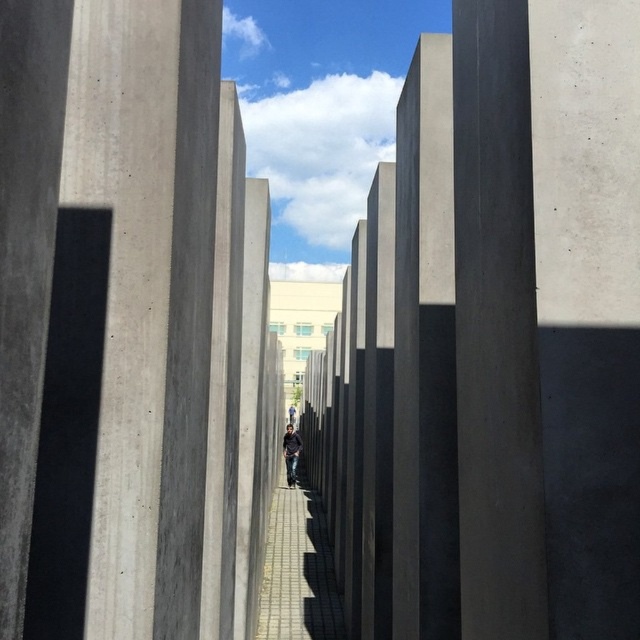
Does smooth concrete pillar at center appear on the left side of gray brick pavement at center?

No, smooth concrete pillar at center is not to the left of gray brick pavement at center.

Is point (477, 586) closer to viewer compared to point (285, 637)?

Yes, it is.

Locate an element on the screen. This screenshot has width=640, height=640. smooth concrete pillar at center is located at coordinates (496, 326).

Is smooth concrete pillar at center positioned at the back of dark blue jeans at center?

That is False.

Which of these two, smooth concrete pillar at center or dark blue jeans at center, stands shorter?

dark blue jeans at center is shorter.

At what (x,y) coordinates should I click in order to perform the action: click on smooth concrete pillar at center. Please return your answer as a coordinate pair (x, y). Looking at the image, I should click on (496, 326).

What do you see at coordinates (298, 572) in the screenshot? The height and width of the screenshot is (640, 640). I see `gray brick pavement at center` at bounding box center [298, 572].

Can you confirm if gray brick pavement at center is positioned below dark blue jeans at center?

No.

Who is more forward, (305, 595) or (288, 432)?

Point (305, 595)

Find the location of `gray brick pavement at center`. gray brick pavement at center is located at coordinates (298, 572).